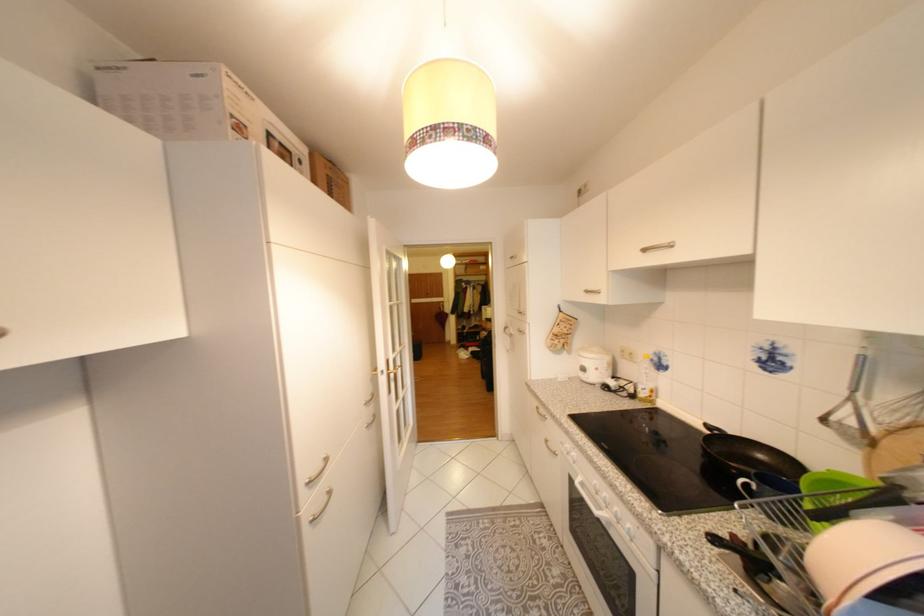
Locate an element on the screen. frying pan handle is located at coordinates (712, 430).